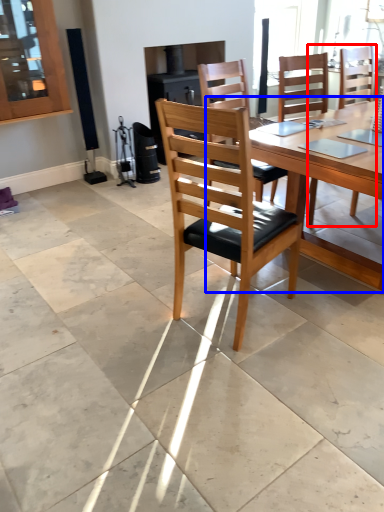
Question: Which object appears closest to the camera in this image, chair (highlighted by a red box) or round table (highlighted by a blue box)?

Choices:
 (A) chair
 (B) round table

Answer: (B)